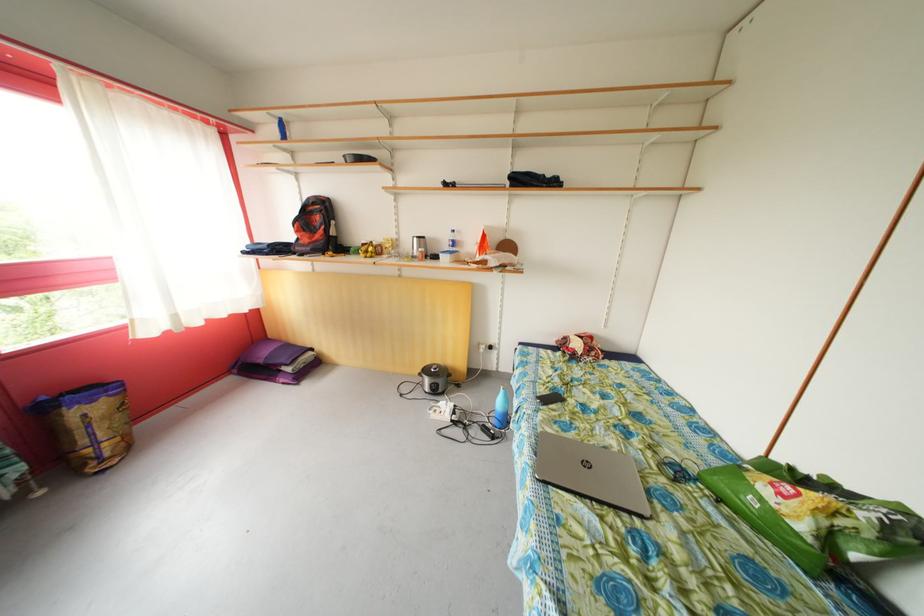
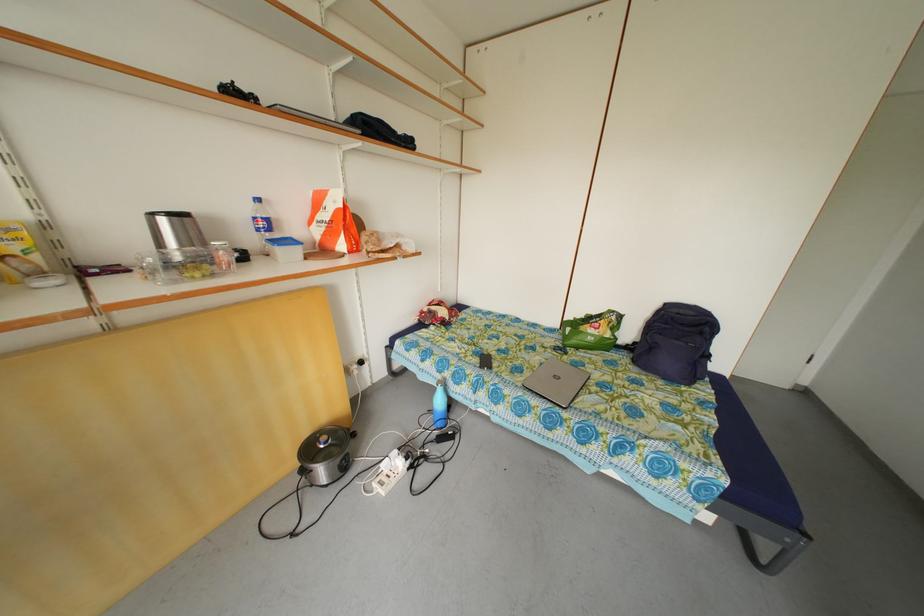
Locate, in the second image, the point that corresponds to [506,408] in the first image.

(446, 408)